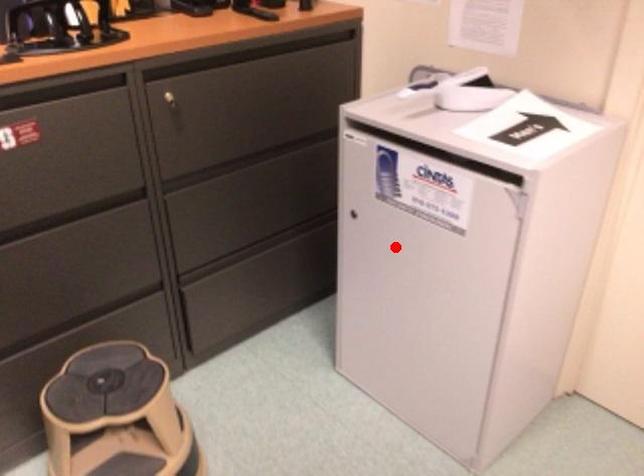
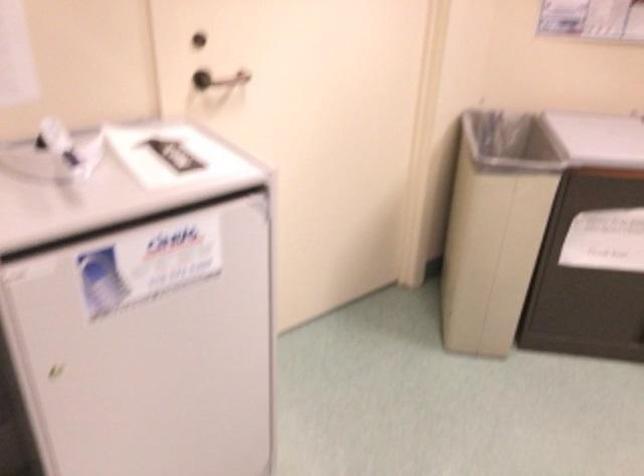
In the second image, find the point that corresponds to the highlighted location in the first image.

(146, 343)